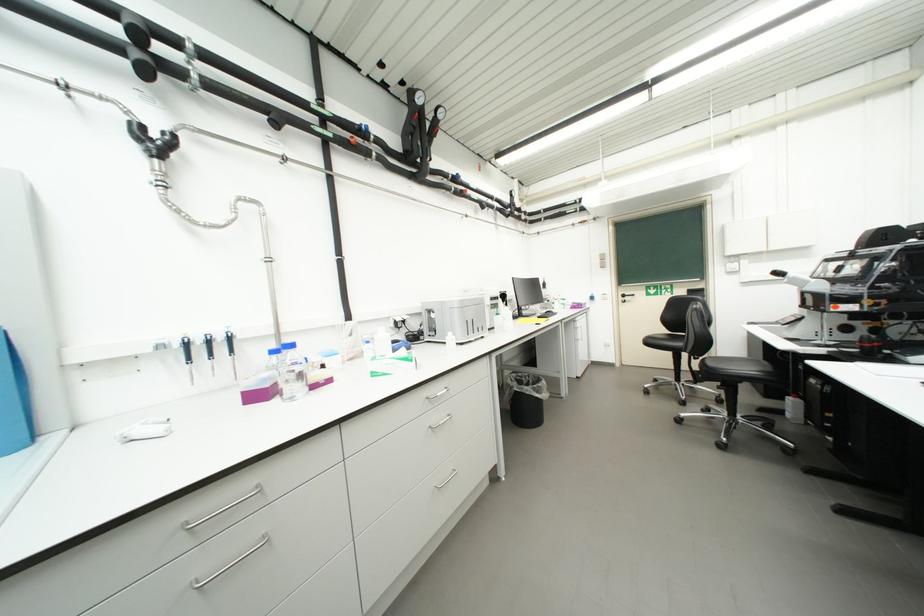
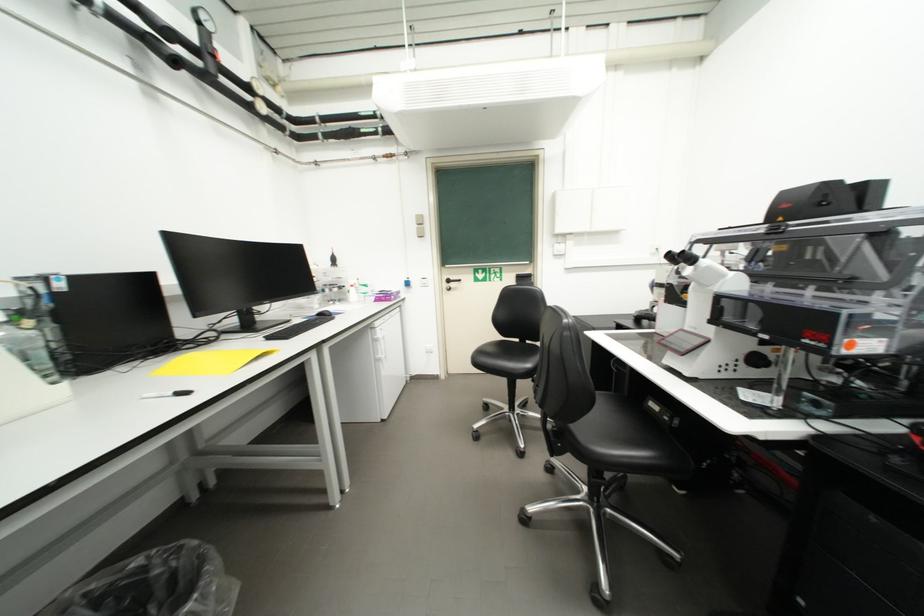
Find the pixel in the second image that matches the point at 786,275 in the first image.

(687, 259)